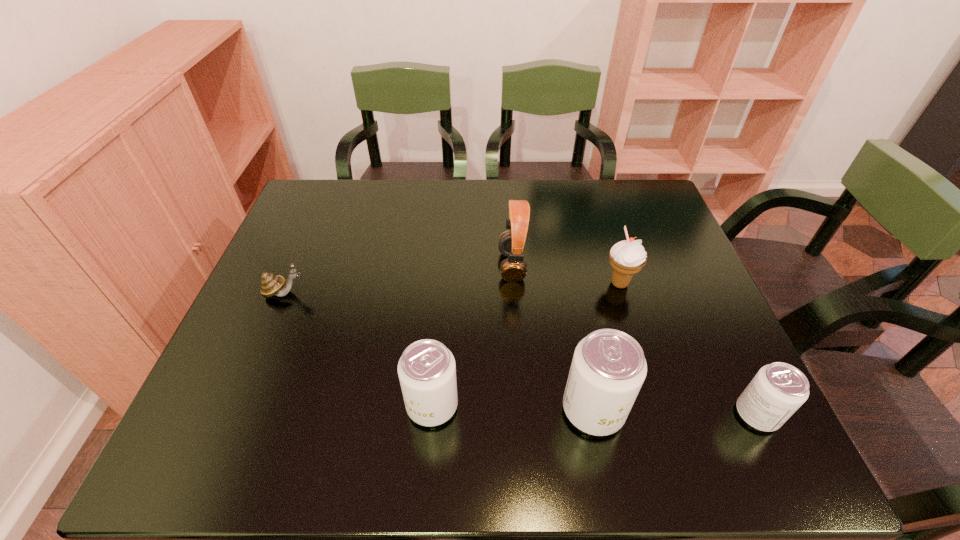
You are a GUI agent. You are given a task and a screenshot of the screen. Output one action in this format:
    pyautogui.click(x=<x>, y=<y>)
    Task: Click on the unoccupied area between the fifth object from left to right and the headset
    The width and height of the screenshot is (960, 540).
    Given the screenshot: What is the action you would take?
    pos(565,275)

Identify which object is located as the fifth nearest to the snail. Please provide its 2D coordinates. Your answer should be formatted as a tuple, i.e. [(x, y)], where the tuple contains the x and y coordinates of a point satisfying the conditions above.

[(777, 391)]

This screenshot has width=960, height=540. Identify the location of the fifth closest object to the tallest soda can. (271, 285).

Identify which soda can is located as the second nearest to the tallest soda can. Please provide its 2D coordinates. Your answer should be formatted as a tuple, i.e. [(x, y)], where the tuple contains the x and y coordinates of a point satisfying the conditions above.

[(777, 391)]

Choose which soda can is the third nearest neighbor to the fifth object from left to right. Please provide its 2D coordinates. Your answer should be formatted as a tuple, i.e. [(x, y)], where the tuple contains the x and y coordinates of a point satisfying the conditions above.

[(427, 372)]

At what (x,y) coordinates should I click in order to perform the action: click on free location that satisfies the following two spatial constraints: 1. on the back side of the leftmost soda can; 2. on the face of the leftmost object. Please return your answer as a coordinate pair (x, y). Image resolution: width=960 pixels, height=540 pixels. Looking at the image, I should click on (442, 293).

Locate an element on the screen. vacant space that satisfies the following two spatial constraints: 1. on the ear cups of the headset; 2. on the left side of the second soda can from left to right is located at coordinates (522, 410).

Identify the location of blank space that satisfies the following two spatial constraints: 1. on the face of the third object from right to left; 2. on the left side of the leftmost object. (234, 410).

In order to click on vacant area in the image that satisfies the following two spatial constraints: 1. on the face of the snail; 2. on the back side of the second object from left to right in this screenshot , I will do `click(236, 405)`.

You are a GUI agent. You are given a task and a screenshot of the screen. Output one action in this format:
    pyautogui.click(x=<x>, y=<y>)
    Task: Click on the free space that satisfies the following two spatial constraints: 1. on the back side of the rightmost soda can; 2. on the face of the snail
    The width and height of the screenshot is (960, 540).
    Given the screenshot: What is the action you would take?
    pyautogui.click(x=699, y=293)